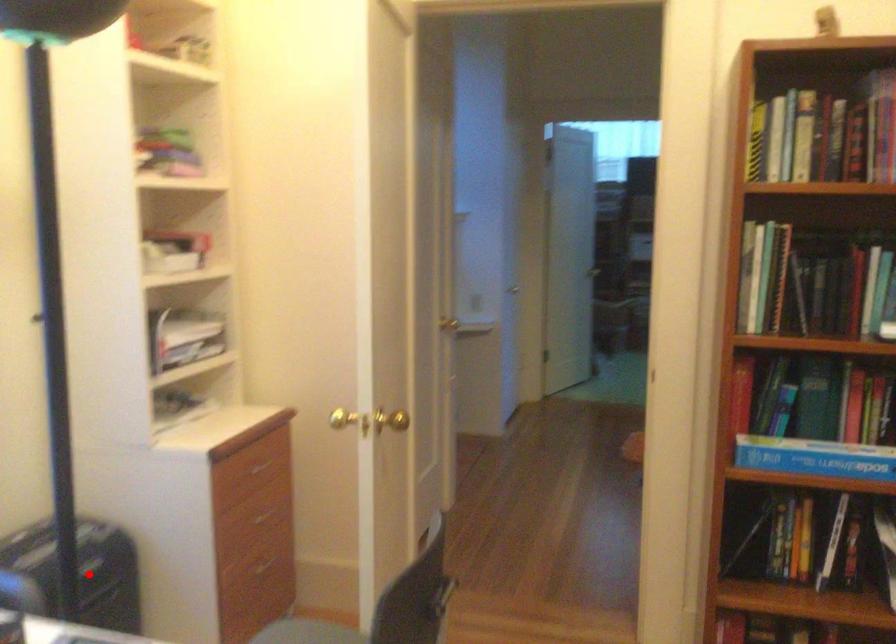
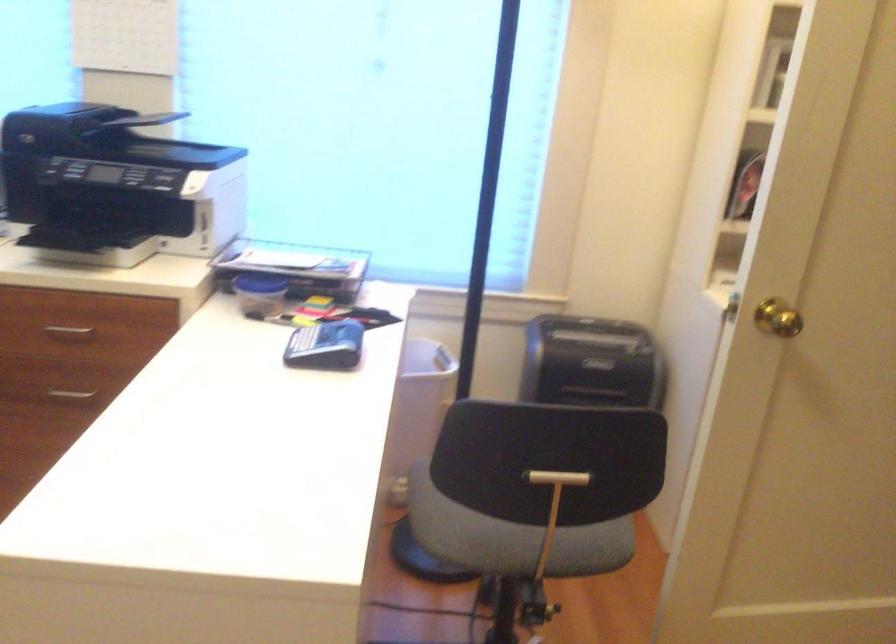
Question: I am providing you with two images of the same scene from different viewpoints. Image1 has a red point marked. In image2, the corresponding 3D location appears at what relative position? Reply with the corresponding letter.

Choices:
 (A) Closer
 (B) Farther

Answer: (B)